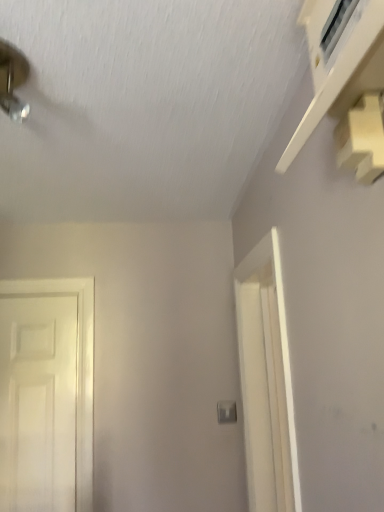
What do you see at coordinates (38, 403) in the screenshot? I see `white matte door at left` at bounding box center [38, 403].

Find the location of a particular element. This screenshot has width=384, height=512. white matte door at left is located at coordinates (38, 403).

Measure the distance between white plastic light switch at center and camera.

white plastic light switch at center and camera are 6.52 feet apart from each other.

The height and width of the screenshot is (512, 384). Describe the element at coordinates (226, 412) in the screenshot. I see `white plastic light switch at center` at that location.

This screenshot has height=512, width=384. Identify the location of white plastic light switch at center. (226, 412).

You are a GUI agent. You are given a task and a screenshot of the screen. Output one action in this format:
    pyautogui.click(x=<x>, y=<y>)
    Task: Click on the white matte door at left
    
    Given the screenshot: What is the action you would take?
    pyautogui.click(x=38, y=403)

In the scene shown: Does white matte door at left appear on the right side of white plastic light switch at center?

No, white matte door at left is not to the right of white plastic light switch at center.

Looking at this image, who is more distant, white matte door at left or white plastic light switch at center?

white plastic light switch at center is further from the camera.

Which point is more distant from viewer, (0, 413) or (218, 409)?

The point (218, 409) is more distant.

From the image's perspective, would you say white matte door at left is positioned over white plastic light switch at center?

Correct, white matte door at left appears higher than white plastic light switch at center in the image.

From a real-world perspective, between white matte door at left and white plastic light switch at center, who is vertically higher?

white matte door at left, from a real-world perspective.

Looking at this image, considering the relative sizes of white matte door at left and white plastic light switch at center in the image provided, is white matte door at left thinner than white plastic light switch at center?

No, white matte door at left is not thinner than white plastic light switch at center.

Does white matte door at left have a lesser height compared to white plastic light switch at center?

In fact, white matte door at left may be taller than white plastic light switch at center.

Consider the image. Considering the sizes of objects white matte door at left and white plastic light switch at center in the image provided, who is smaller, white matte door at left or white plastic light switch at center?

Smaller between the two is white plastic light switch at center.

In the scene shown: Is white matte door at left not within white plastic light switch at center?

That's correct, white matte door at left is outside of white plastic light switch at center.

From the picture: Can you see white matte door at left touching white plastic light switch at center?

There is a gap between white matte door at left and white plastic light switch at center.

Could you tell me if white matte door at left is facing white plastic light switch at center?

No.

The image size is (384, 512). What are the coordinates of `light switch below the white matte door at left (from the image's perspective)` in the screenshot? It's located at (226, 412).

Between white plastic light switch at center and white matte door at left, which one appears on the left side from the viewer's perspective?

white matte door at left is more to the left.

From the picture: Considering the positions of objects white plastic light switch at center and white matte door at left in the image provided, who is behind, white plastic light switch at center or white matte door at left?

white plastic light switch at center is further away from the camera.

Does point (233, 420) appear closer or farther from the camera than point (29, 343)?

Clearly, point (233, 420) is closer to the camera than point (29, 343).

From the image's perspective, which is below, white plastic light switch at center or white matte door at left?

From the image's view, white plastic light switch at center is below.

From a real-world perspective, which is physically above, white plastic light switch at center or white matte door at left?

white matte door at left is physically above.

Considering the relative sizes of white plastic light switch at center and white matte door at left in the image provided, is white plastic light switch at center wider than white matte door at left?

No, white plastic light switch at center is not wider than white matte door at left.

Considering the relative sizes of white plastic light switch at center and white matte door at left in the image provided, is white plastic light switch at center taller than white matte door at left?

Incorrect, the height of white plastic light switch at center is not larger of that of white matte door at left.

Between white plastic light switch at center and white matte door at left, which one has smaller size?

white plastic light switch at center.

Is white plastic light switch at center positioned beyond the bounds of white matte door at left?

white plastic light switch at center lies outside white matte door at left's area.

Is white plastic light switch at center not near white matte door at left?

That's not correct — white plastic light switch at center is a little close to white matte door at left.

Could you tell me if white plastic light switch at center is facing white matte door at left?

No, white plastic light switch at center is not facing towards white matte door at left.

How many degrees apart are the facing directions of white plastic light switch at center and white matte door at left?

The angle between the facing direction of white plastic light switch at center and the facing direction of white matte door at left is 0.151 degrees.

In order to click on light switch directly beneath the white matte door at left (from a real-world perspective) in this screenshot , I will do `click(226, 412)`.

This screenshot has height=512, width=384. I want to click on light switch behind the white matte door at left, so click(226, 412).

Where is `door on the left side of white plastic light switch at center`? Image resolution: width=384 pixels, height=512 pixels. door on the left side of white plastic light switch at center is located at coordinates (38, 403).